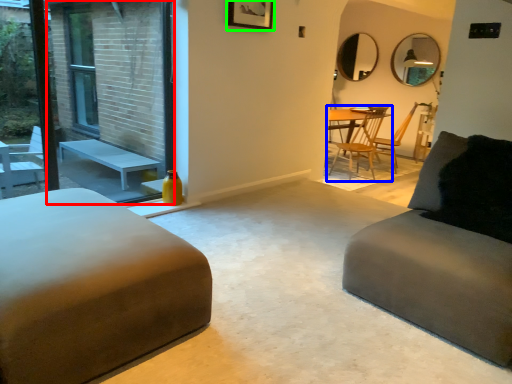
Question: Based on their relative distances, which object is nearer to screen door (highlighted by a red box)? Choose from chair (highlighted by a blue box) and picture frame (highlighted by a green box).

Choices:
 (A) chair
 (B) picture frame

Answer: (B)